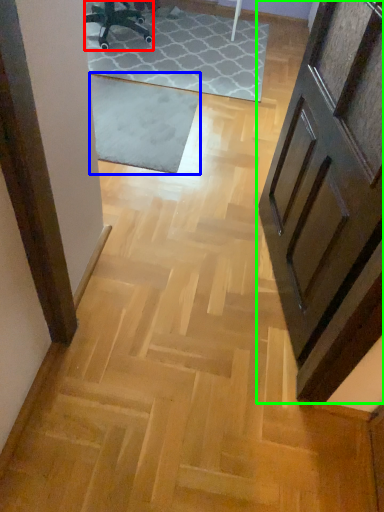
Question: Which object is the farthest from chair (highlighted by a red box)? Choose among these: mat (highlighted by a blue box) or door (highlighted by a green box).

Choices:
 (A) mat
 (B) door

Answer: (B)